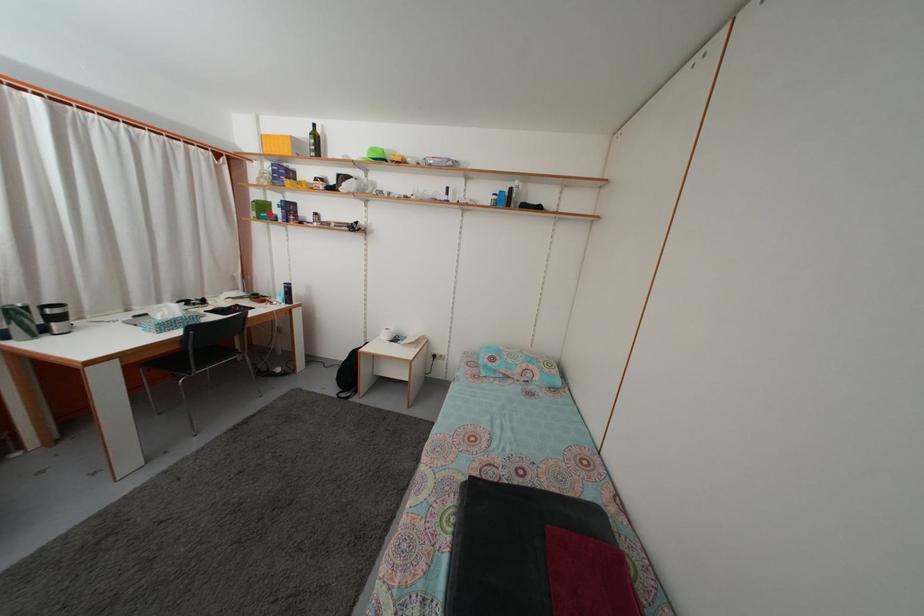
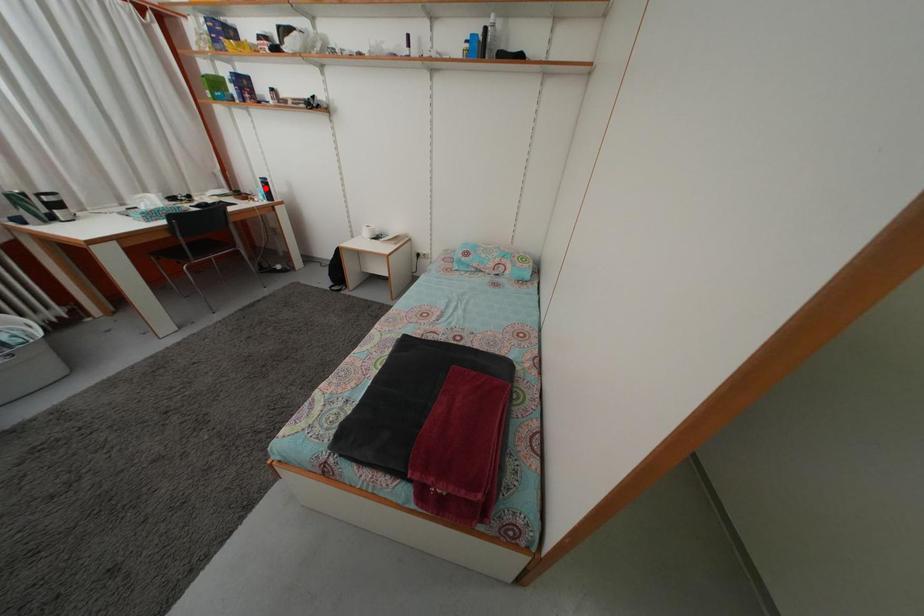
I am providing you with two images of the same scene from different viewpoints. A red point is marked on the first image and another point is marked on the second image. Is the red point in image1 aligned with the point shown in image2?

No